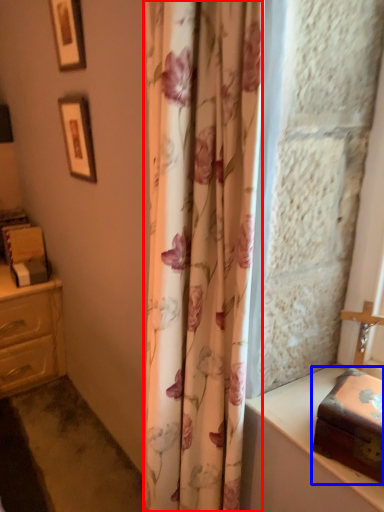
Question: Among these objects, which one is nearest to the camera, shower curtain (highlighted by a red box) or box (highlighted by a blue box)?

Choices:
 (A) shower curtain
 (B) box

Answer: (A)